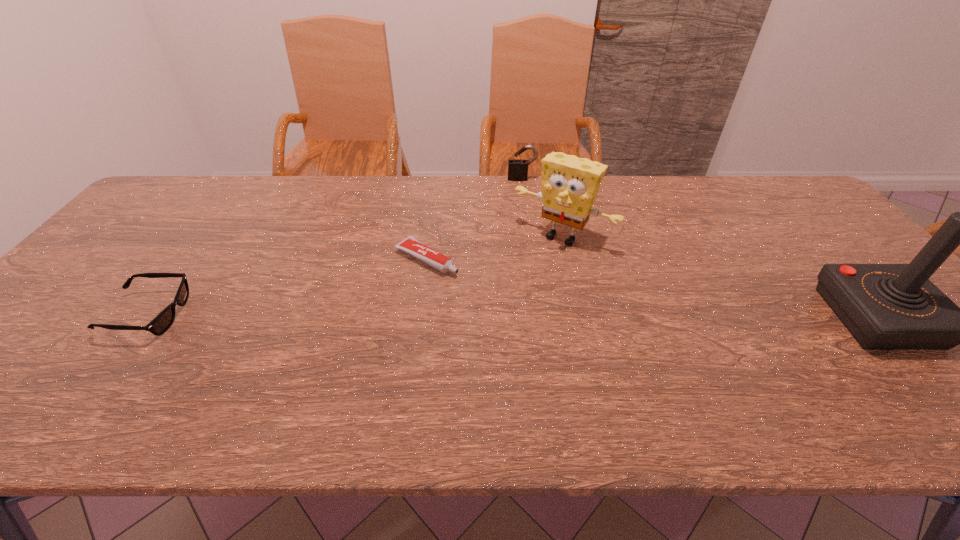
Identify the location of vacant region located on the rectangular base of the tallest object. (930, 376).

Image resolution: width=960 pixels, height=540 pixels. What are the coordinates of `vacant point located 0.190m at the nozzle of the shortest object` in the screenshot? It's located at (509, 303).

This screenshot has height=540, width=960. What are the coordinates of `free space located 0.320m at the nozzle of the shortest object` in the screenshot? It's located at (554, 329).

This screenshot has width=960, height=540. What are the coordinates of `free space located 0.120m at the nozzle of the shortest object` in the screenshot? It's located at (487, 291).

Locate an element on the screen. This screenshot has height=540, width=960. vacant space situated 0.270m with the keyhole on the front of the farthest object is located at coordinates (524, 228).

Locate an element on the screen. The width and height of the screenshot is (960, 540). blank space located 0.310m with the keyhole on the front of the farthest object is located at coordinates (524, 237).

Where is `vacant space located 0.240m with the keyhole on the front of the farthest object`? The height and width of the screenshot is (540, 960). vacant space located 0.240m with the keyhole on the front of the farthest object is located at coordinates (524, 222).

You are a GUI agent. You are given a task and a screenshot of the screen. Output one action in this format:
    pyautogui.click(x=<x>, y=<y>)
    Task: Click on the vacant space located on the face of the fourth shortest object
    The height and width of the screenshot is (540, 960).
    Given the screenshot: What is the action you would take?
    pyautogui.click(x=480, y=335)

Identify the location of free space located 0.370m on the face of the fourth shortest object. Image resolution: width=960 pixels, height=540 pixels. (473, 345).

Where is `free space located 0.250m on the face of the fourth shortest object`? The width and height of the screenshot is (960, 540). free space located 0.250m on the face of the fourth shortest object is located at coordinates (498, 310).